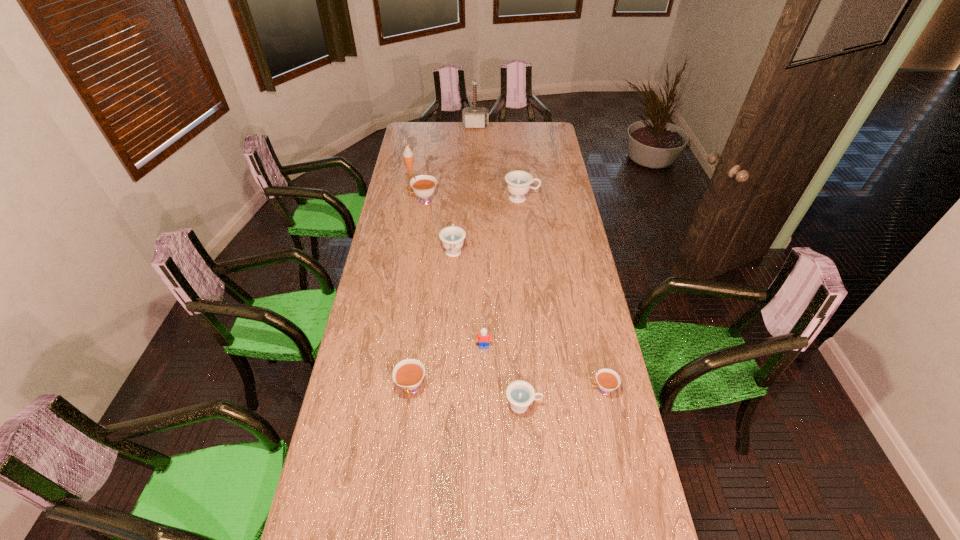
I want to click on the tallest object, so click(472, 117).

Identify the location of hammer. (472, 117).

Where is `the eighth nearest object`? The image size is (960, 540). the eighth nearest object is located at coordinates (408, 155).

I want to click on the leftmost object, so click(408, 155).

Where is `the farthest blue teacup`? the farthest blue teacup is located at coordinates (518, 182).

Where is `the biggest white teacup`? The image size is (960, 540). the biggest white teacup is located at coordinates (424, 185).

The width and height of the screenshot is (960, 540). I want to click on the third teacup from left to right, so click(x=452, y=237).

Identify the location of the leftmost blue teacup. (452, 237).

Image resolution: width=960 pixels, height=540 pixels. In order to click on white Lego in this screenshot , I will do `click(484, 338)`.

Locate an element on the screen. This screenshot has height=540, width=960. the sixth farthest object is located at coordinates (484, 338).